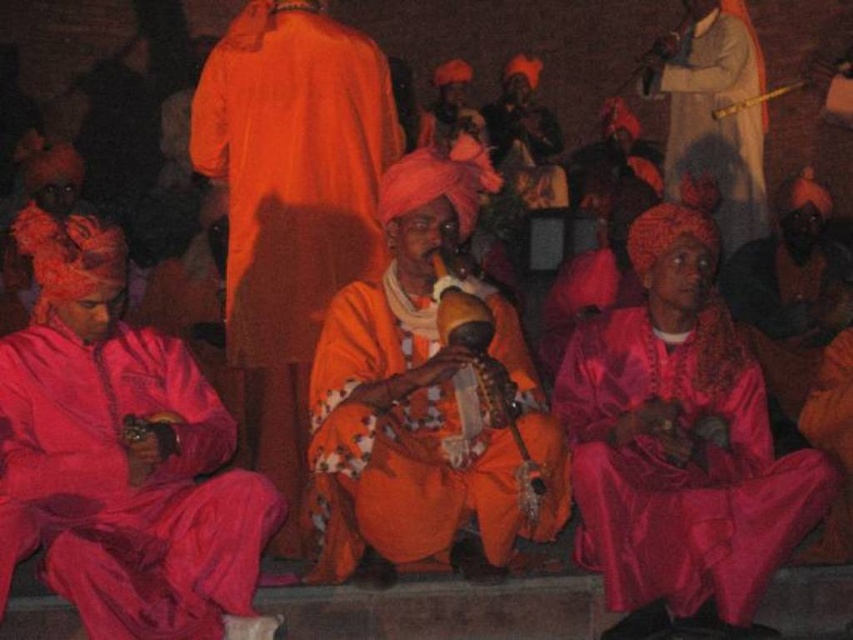
You are a photographer at the event and want to capture the shiny silk robe at lower right in your photo. Where should you position your camera to ensure it is in frame?

To capture the shiny silk robe at lower right, position your camera so that it is focused on the lower right area of the scene, specifically at the coordinates point (680, 467).

You are an event planner trying to place a small microphone stand for the performer wearing the orange silk robe at center. The stage manager provided coordinates in a grid system where the bottom left corner is the origin point. The coordinates given for the performer are point (289, 209). Where should you place the microphone stand relative to the orange silk robe at center?

The orange silk robe at center is located at point (289, 209), so the microphone stand should be placed directly in front of the orange silk robe at center at the same coordinates to ensure the performer can easily access it.